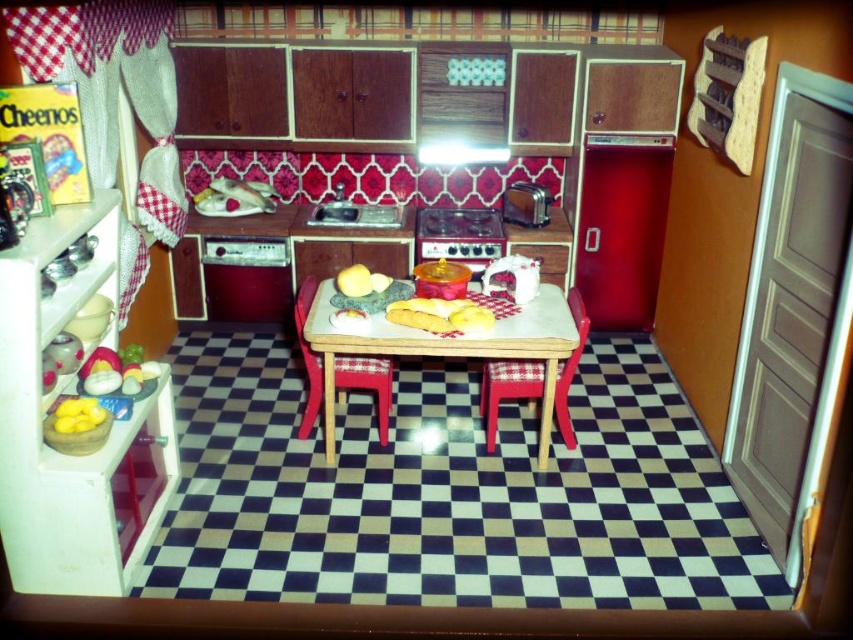
Question: Which object appears farthest from the camera in this image?

Choices:
 (A) metallic silver stove at center
 (B) satin silver toaster at upper right
 (C) wooden table at center
 (D) red fabric chair at center

Answer: (A)

Question: Estimate the real-world distances between objects in this image. Which object is farther from the golden bread at center?

Choices:
 (A) yellow matte eggs at center
 (B) satin silver toaster at upper right

Answer: (A)

Question: Which point is closer to the camera?

Choices:
 (A) (540, 204)
 (B) (103, 416)
 (C) (357, 276)

Answer: (B)

Question: Does red checkered fabric chair at center appear on the left side of yellow matte bread at center?

Choices:
 (A) no
 (B) yes

Answer: (A)

Question: Is yellow matte eggs at center to the left of yellow matte apple at center from the viewer's perspective?

Choices:
 (A) yes
 (B) no

Answer: (A)

Question: Does wooden table at center appear under yellow matte apple at center?

Choices:
 (A) yes
 (B) no

Answer: (A)